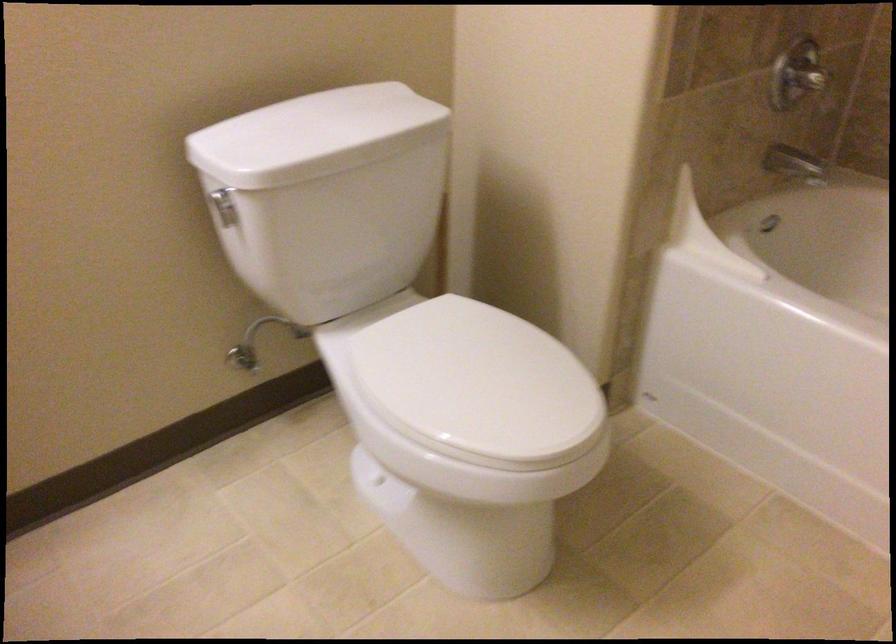
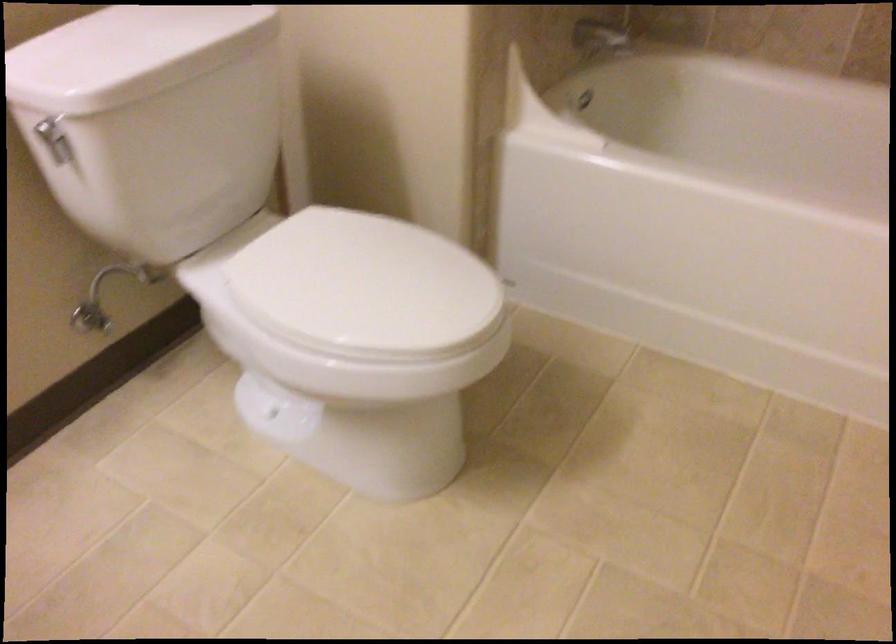
Question: The camera is either moving clockwise (left) or counter-clockwise (right) around the object. The first image is from the beginning of the video and the second image is from the end. Is the camera moving left or right when shooting the video?

Choices:
 (A) Left
 (B) Right

Answer: (A)